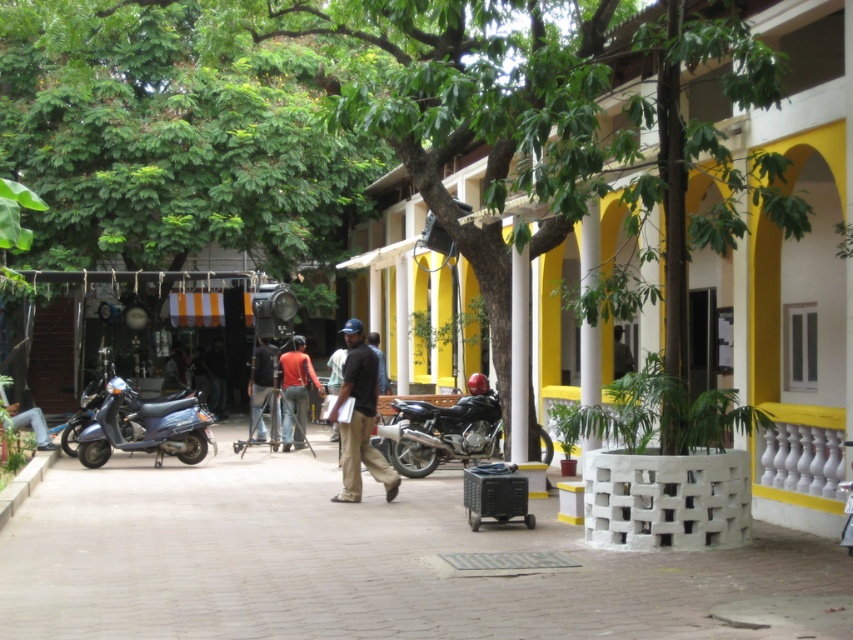
Is brown brick pavement at center further to camera compared to metallic blue scooter at lower left?

No, it is in front of metallic blue scooter at lower left.

Find the location of a particular element. brown brick pavement at center is located at coordinates (366, 563).

Does point (76, 628) come behind point (164, 429)?

No, it is not.

The width and height of the screenshot is (853, 640). I want to click on brown brick pavement at center, so click(x=366, y=563).

Is metallic blue scooter at lower left to the left of dark brown leather jacket at center from the viewer's perspective?

Yes, metallic blue scooter at lower left is to the left of dark brown leather jacket at center.

Based on the photo, does metallic blue scooter at lower left appear over dark brown leather jacket at center?

Actually, metallic blue scooter at lower left is below dark brown leather jacket at center.

Who is more distant from viewer, (91,422) or (363,349)?

The point (91,422) is behind.

Identify the location of metallic blue scooter at lower left. The image size is (853, 640). (144, 428).

Can you confirm if shiny black motorcycle at center is bigger than matte orange shirt at center?

Indeed, shiny black motorcycle at center has a larger size compared to matte orange shirt at center.

Does shiny black motorcycle at center appear over matte orange shirt at center?

Actually, shiny black motorcycle at center is below matte orange shirt at center.

Which is behind, point (486, 381) or point (314, 381)?

The point (314, 381) is more distant.

You are a GUI agent. You are given a task and a screenshot of the screen. Output one action in this format:
    pyautogui.click(x=<x>, y=<y>)
    Task: Click on the shiny black motorcycle at center
    The image size is (853, 640).
    Given the screenshot: What is the action you would take?
    pyautogui.click(x=442, y=429)